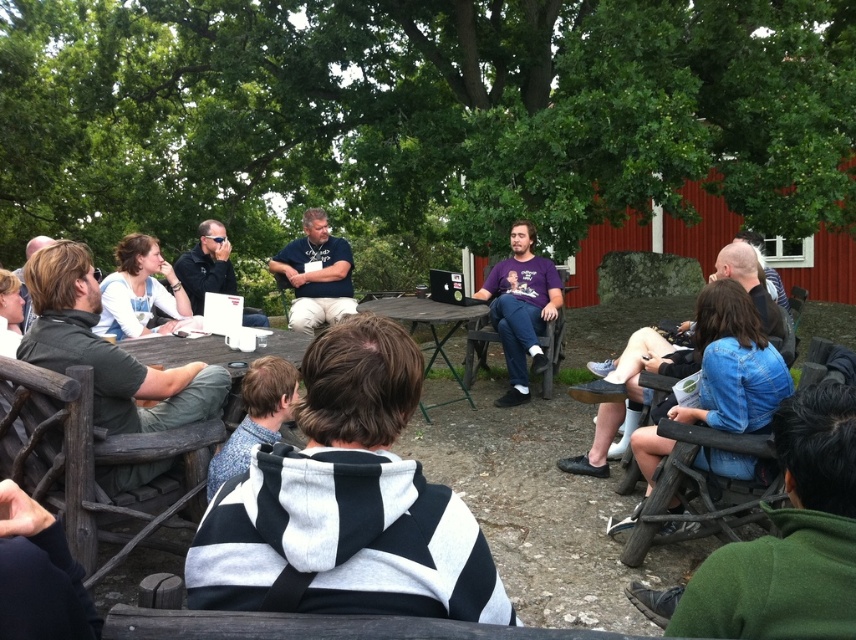
Question: Among these points, which one is nearest to the camera?

Choices:
 (A) (169, 362)
 (B) (316, 326)
 (C) (783, 378)

Answer: (C)

Question: Among these objects, which one is nearest to the camera?

Choices:
 (A) black and white striped hoodie at center
 (B) matte black shirt at center

Answer: (A)

Question: Does dark green shirt at left appear under purple cotton shirt at center?

Choices:
 (A) no
 (B) yes

Answer: (B)

Question: Does dark green shirt at left have a lesser width compared to matte black shirt at center?

Choices:
 (A) no
 (B) yes

Answer: (A)

Question: Is white shirt at center to the right of wooden table at center from the viewer's perspective?

Choices:
 (A) no
 (B) yes

Answer: (A)

Question: Which point appears farthest from the camera in this image?

Choices:
 (A) (169, 339)
 (B) (210, 404)

Answer: (A)